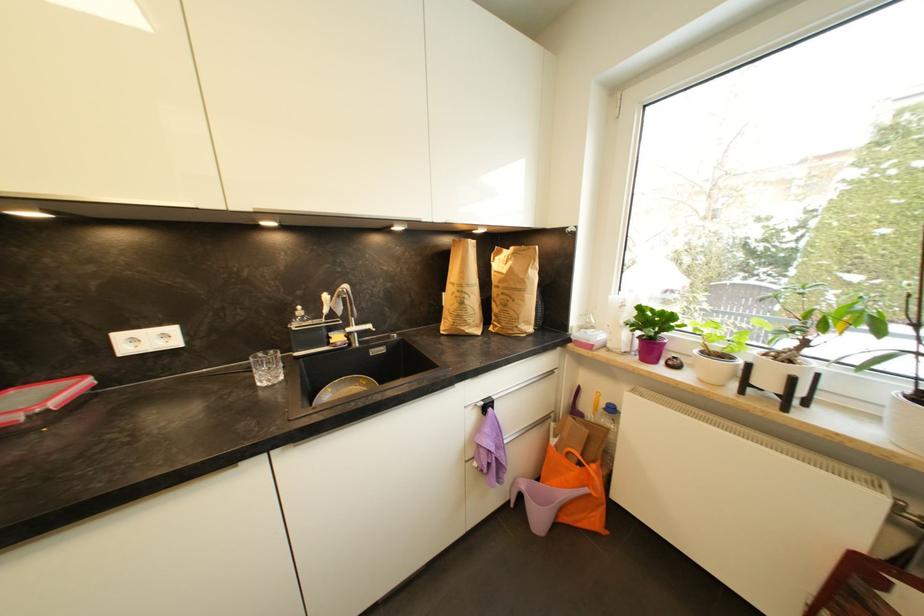
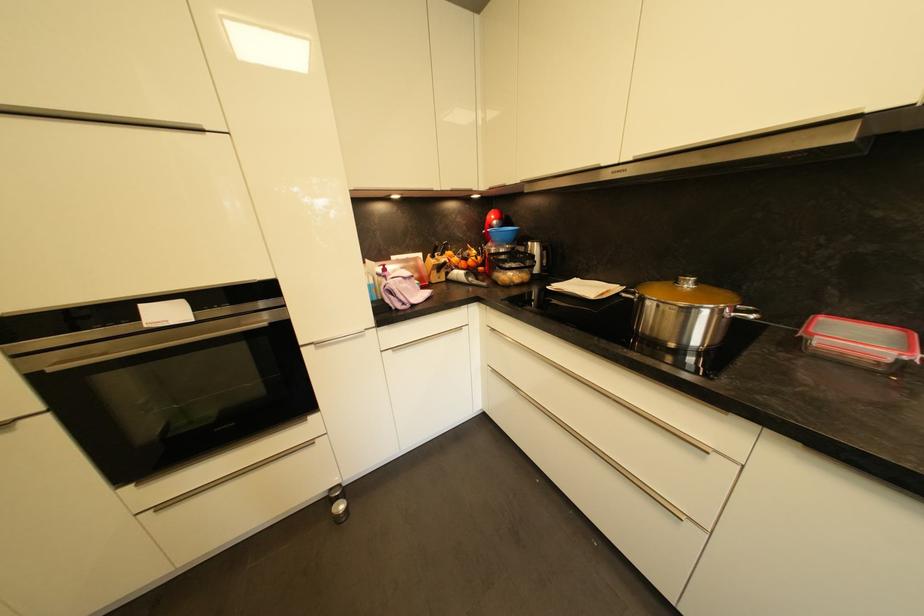
In the second image, find the point that corresponds to (x=33, y=385) in the first image.

(836, 315)